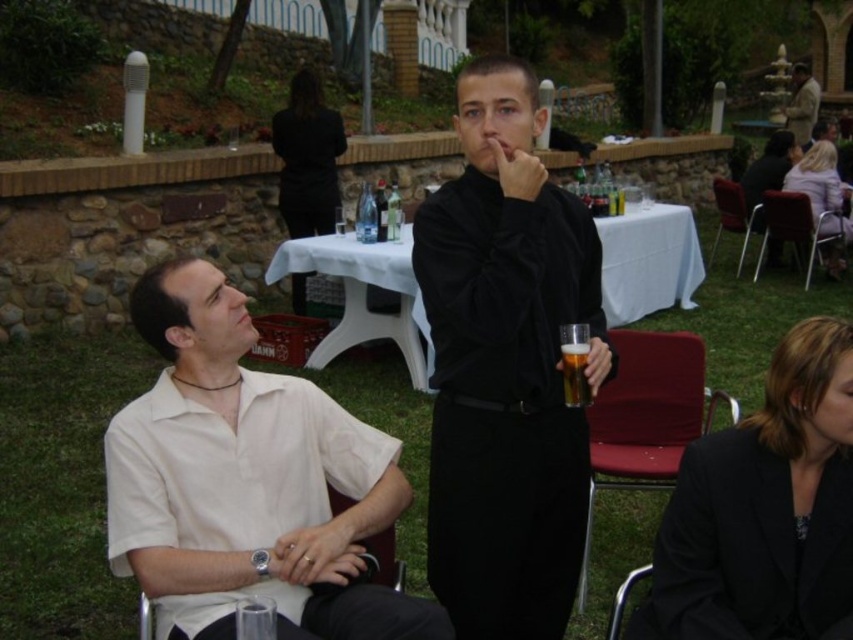
Question: Which point is closer to the camera?

Choices:
 (A) smooth pink dress at upper right
 (B) black fabric jacket at lower right

Answer: (B)

Question: Is red fabric chair at lower right smaller than black leather chair at left?

Choices:
 (A) yes
 (B) no

Answer: (B)

Question: Does light beige suit at upper right lie in front of translucent glass beer at center?

Choices:
 (A) no
 (B) yes

Answer: (A)

Question: Does black leather chair at left have a greater width compared to metallic silver chair at lower right?

Choices:
 (A) no
 (B) yes

Answer: (B)

Question: Considering the real-world distances, which object is closest to the white cloth table at center?

Choices:
 (A) black satin shirt at center
 (B) metallic silver chair at lower right

Answer: (A)

Question: Which point is farther to the camera?

Choices:
 (A) (462, 483)
 (B) (379, 572)

Answer: (A)